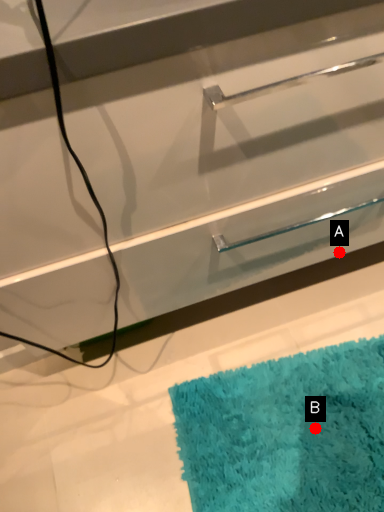
Question: Two points are circled on the image, labeled by A and B beside each circle. Among these points, which one is farthest from the camera?

Choices:
 (A) A is further
 (B) B is further

Answer: (B)